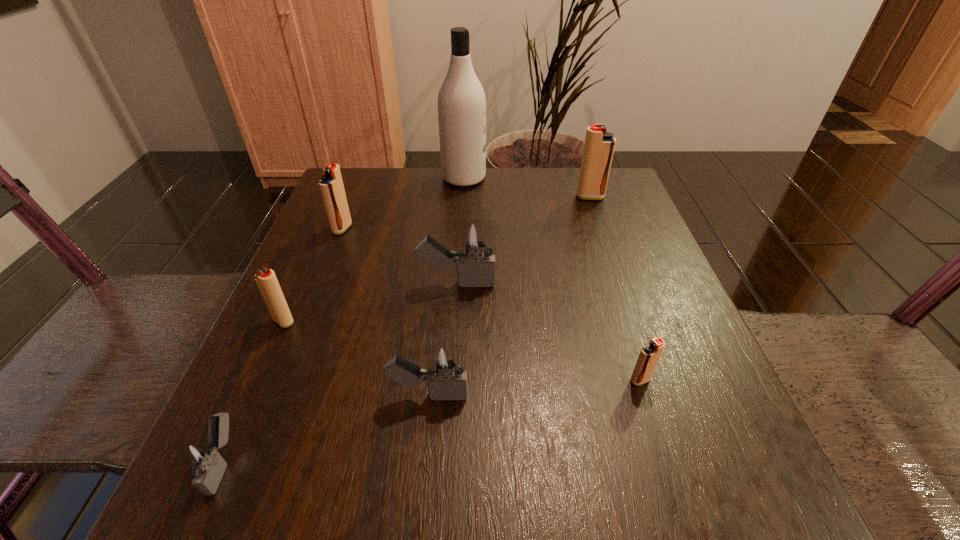
Where is `shampoo`? shampoo is located at coordinates (461, 100).

I want to click on white shampoo, so click(461, 100).

Find the location of `the tallest igniter`. the tallest igniter is located at coordinates (599, 146).

The image size is (960, 540). I want to click on the farthest igniter, so click(x=599, y=146).

Find the location of a particular element. This screenshot has width=960, height=540. the third smallest red igniter is located at coordinates (331, 185).

Identify the location of the second farthest red igniter. The width and height of the screenshot is (960, 540). (331, 185).

Image resolution: width=960 pixels, height=540 pixels. What are the coordinates of `the fifth nearest object` in the screenshot? It's located at pyautogui.click(x=477, y=238).

Identify the location of the farthest gray igniter. This screenshot has width=960, height=540. (477, 238).

The height and width of the screenshot is (540, 960). Identify the location of the second nearest gray igniter. (445, 371).

I want to click on the third farthest red igniter, so click(266, 280).